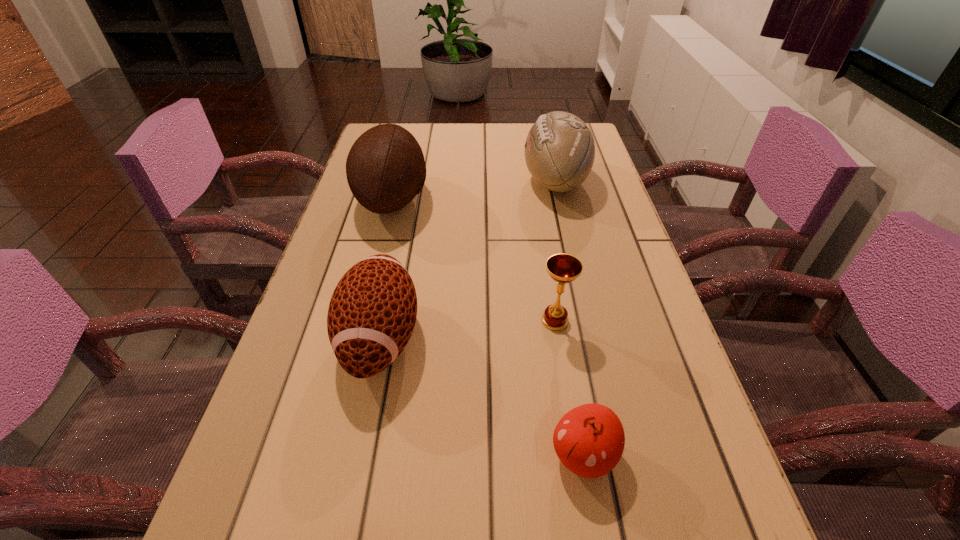
You are a GUI agent. You are given a task and a screenshot of the screen. Output one action in this format:
    pyautogui.click(x=<x>, y=<y>)
    Task: Click on the vacant position located 0.100m on the left of the apple
    This screenshot has width=960, height=540.
    Given the screenshot: What is the action you would take?
    pyautogui.click(x=486, y=455)

Find the location of a particular element. object positioned at the far edge is located at coordinates coord(559,151).

Locate an element on the screen. This screenshot has width=960, height=540. football (American) that is at the right edge is located at coordinates (559, 151).

Image resolution: width=960 pixels, height=540 pixels. I want to click on apple that is at the right edge, so tap(589, 440).

The image size is (960, 540). In order to click on object that is at the far right corner in this screenshot , I will do point(559,151).

At what (x,y) coordinates should I click in order to perform the action: click on blank space at the far edge. Please return your answer as a coordinate pair (x, y). Image resolution: width=960 pixels, height=540 pixels. Looking at the image, I should click on (500, 129).

In the image, there is a desktop. Where is `vacant area at the right edge`? This screenshot has width=960, height=540. vacant area at the right edge is located at coordinates (668, 346).

You are a GUI agent. You are given a task and a screenshot of the screen. Output one action in this format:
    pyautogui.click(x=<x>, y=<y>)
    Task: Click on the free space that is in between the rightmost football and the nearest football
    This screenshot has width=960, height=540.
    Given the screenshot: What is the action you would take?
    pyautogui.click(x=468, y=259)

Identify the location of unoccupied area between the rightmost football and the shortest object. The image size is (960, 540). (569, 318).

Identify the location of vacant area between the shortest football and the nearest object. This screenshot has height=540, width=960. (482, 396).